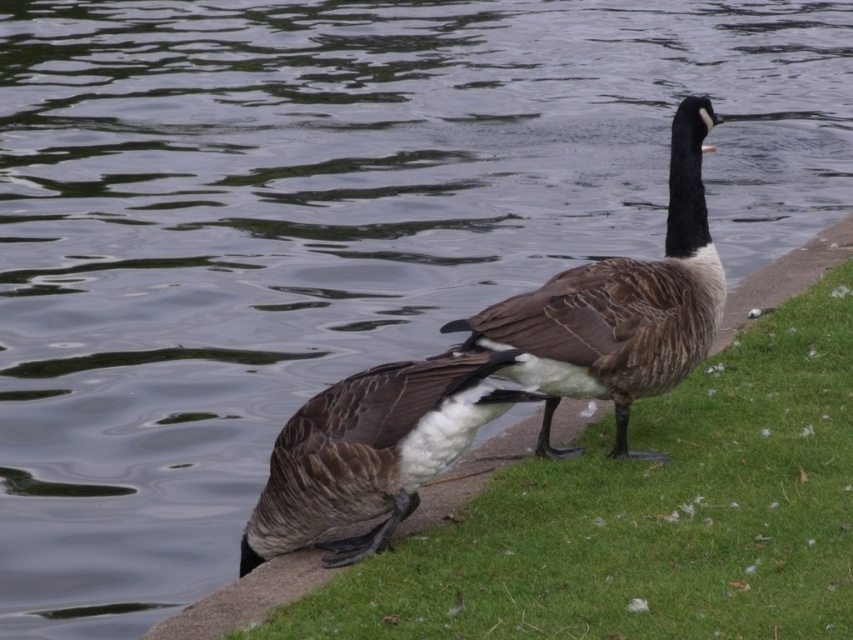
At what (x,y) coordinates should I click in order to perform the action: click on green grass at lower right. Please return your answer as a coordinate pair (x, y). Looking at the image, I should click on (647, 516).

Is point (845, 499) closer to camera compared to point (281, 529)?

No.

Which is behind, point (660, 609) or point (317, 500)?

Point (317, 500)

Identify the location of green grass at lower right. Image resolution: width=853 pixels, height=640 pixels. (647, 516).

Can you confirm if green grass at lower right is positioned to the right of brown speckled goose at center?

Indeed, green grass at lower right is positioned on the right side of brown speckled goose at center.

Can you confirm if green grass at lower right is smaller than brown speckled goose at center?

Actually, green grass at lower right might be larger than brown speckled goose at center.

Find the location of a particular element. The image size is (853, 640). green grass at lower right is located at coordinates (647, 516).

At what (x,y) coordinates should I click in order to perform the action: click on green grass at lower right. Please return your answer as a coordinate pair (x, y). Looking at the image, I should click on (647, 516).

Is point (558, 458) positioned behind point (416, 472)?

Yes, point (558, 458) is farther from viewer.

Does point (642, 326) lie in front of point (440, 428)?

No, it is behind (440, 428).

Is point (544, 349) positioned in front of point (421, 388)?

No, it is not.

In order to click on brown speckled goose at center in this screenshot , I will do `click(619, 307)`.